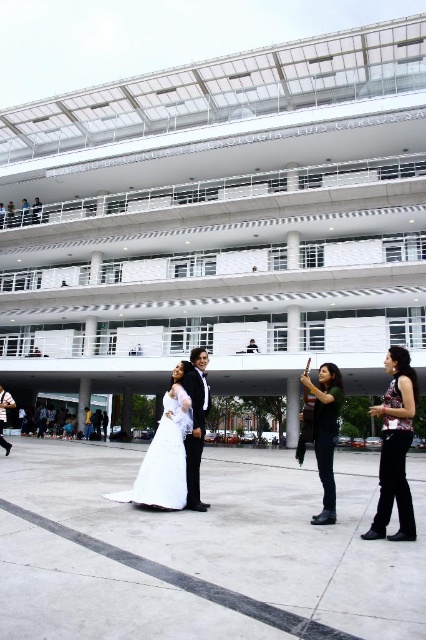
Can you confirm if denim jacket at lower right is shorter than shiny black suit at center?

Indeed, denim jacket at lower right has a lesser height compared to shiny black suit at center.

Which is behind, point (316, 394) or point (193, 353)?

Point (193, 353)

Identify the location of denim jacket at lower right. The image size is (426, 640). (324, 433).

Between white satin dress at center and denim jacket at lower right, which one is positioned higher?

Positioned higher is denim jacket at lower right.

Is white satin dress at center further to camera compared to denim jacket at lower right?

Yes.

Does point (178, 440) lie in front of point (325, 480)?

That is False.

I want to click on white satin dress at center, so click(164, 458).

How much distance is there between white satin dress at lower center and white satin dress at center?

white satin dress at lower center is 10.10 feet from white satin dress at center.

Is point (394, 458) positioned behind point (175, 442)?

No, (394, 458) is in front of (175, 442).

Does point (327, 396) lie behind point (126, 492)?

No, (327, 396) is closer to viewer.

You are a GUI agent. You are given a task and a screenshot of the screen. Output one action in this format:
    pyautogui.click(x=<x>, y=<y>)
    Task: Click on the white satin dress at lower center
    
    Given the screenshot: What is the action you would take?
    pyautogui.click(x=394, y=445)